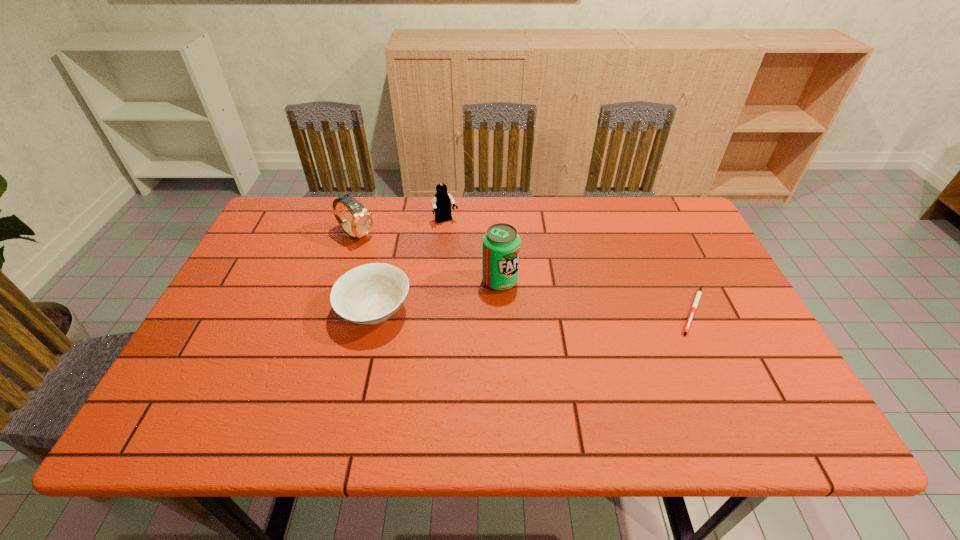
Identify the location of free space located 0.050m on the front-facing side of the tallest object. (533, 294).

At what (x,y) coordinates should I click in order to perform the action: click on blank area located on the front-facing side of the tallest object. Please return your answer as a coordinate pair (x, y). Image resolution: width=960 pixels, height=540 pixels. Looking at the image, I should click on (643, 340).

You are a GUI agent. You are given a task and a screenshot of the screen. Output one action in this format:
    pyautogui.click(x=<x>, y=<y>)
    Task: Click on the vacant space located 0.130m on the front-facing side of the third object from left to right
    The image size is (960, 540).
    Given the screenshot: What is the action you would take?
    pyautogui.click(x=467, y=252)

Locate an element on the screen. This screenshot has height=540, width=960. free space located 0.120m on the front-facing side of the third object from left to right is located at coordinates (465, 250).

The image size is (960, 540). I want to click on vacant space located 0.170m on the front-facing side of the third object from left to right, so click(471, 261).

In order to click on vacant position located on the face of the watch in this screenshot , I will do `click(454, 291)`.

In order to click on blank space located on the face of the watch in this screenshot , I will do `click(440, 282)`.

Locate an element on the screen. Image resolution: width=960 pixels, height=540 pixels. free location located on the face of the watch is located at coordinates (428, 276).

Locate an element on the screen. Lego located in the far edge section of the desktop is located at coordinates (441, 204).

Locate an element on the screen. The image size is (960, 540). watch situated at the far edge is located at coordinates (362, 222).